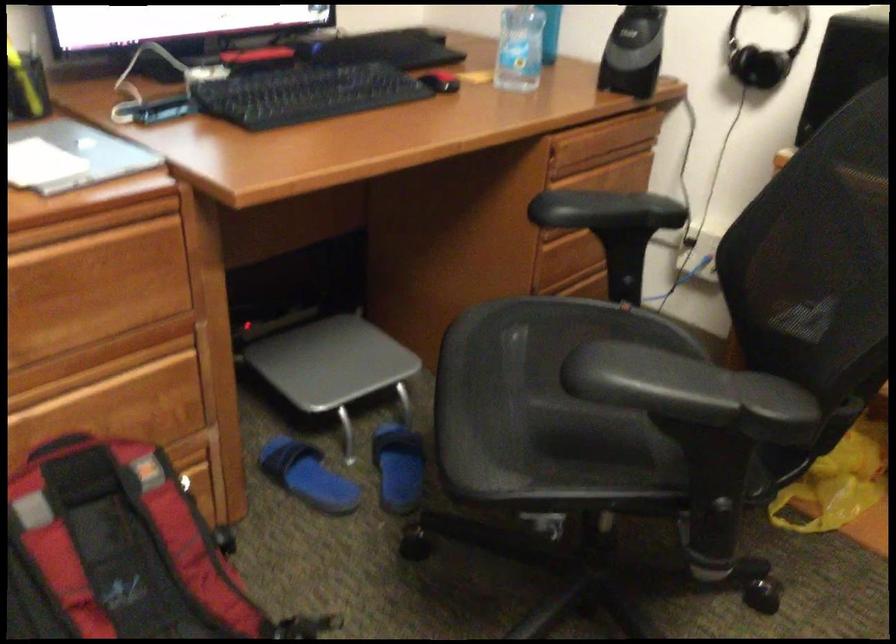
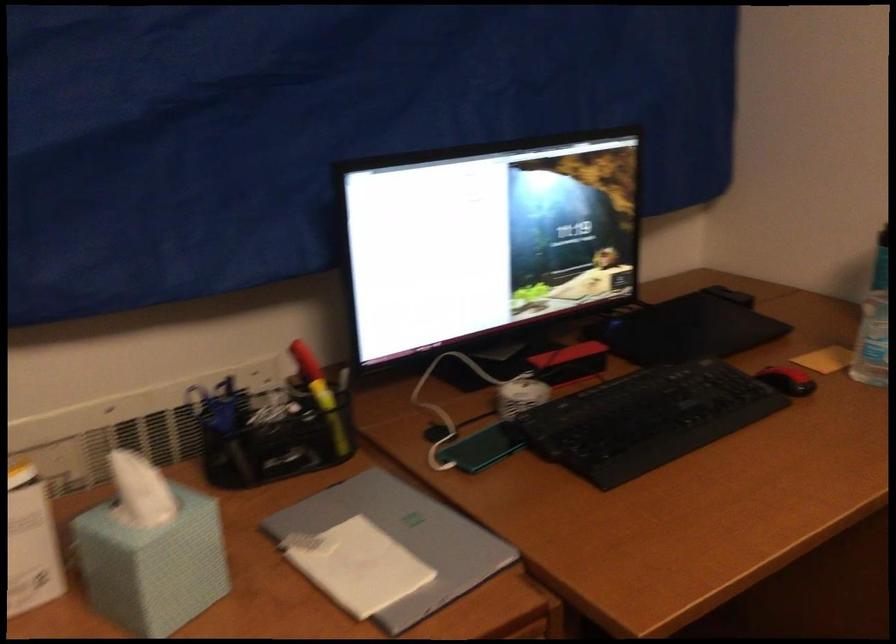
Question: The camera is either moving clockwise (left) or counter-clockwise (right) around the object. The first image is from the beginning of the video and the second image is from the end. Is the camera moving left or right when shooting the video?

Choices:
 (A) Left
 (B) Right

Answer: (B)